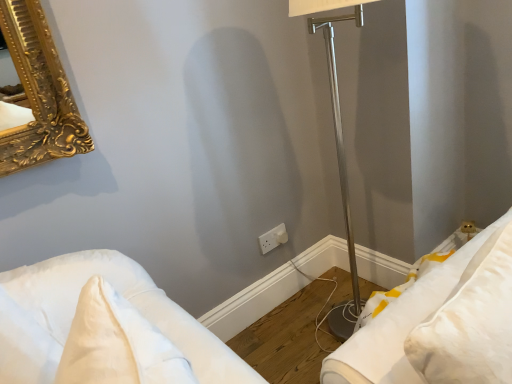
Question: Can white fabric pillow at lower right, the first furniture viewed from the right, be found inside white soft pillow at lower left, the second furniture when ordered from right to left?

Choices:
 (A) yes
 (B) no

Answer: (B)

Question: From the image's perspective, is white soft pillow at lower left, the second furniture when ordered from right to left, below white fabric pillow at lower right, the first furniture viewed from the right?

Choices:
 (A) no
 (B) yes

Answer: (B)

Question: Considering the relative sizes of white soft pillow at lower left, the second furniture when ordered from right to left, and white fabric pillow at lower right, the 2th furniture from the left, in the image provided, is white soft pillow at lower left, the second furniture when ordered from right to left, shorter than white fabric pillow at lower right, the 2th furniture from the left,?

Choices:
 (A) no
 (B) yes

Answer: (B)

Question: Can you confirm if white soft pillow at lower left, marked as the 1th furniture in a left-to-right arrangement, is taller than white fabric pillow at lower right, the first furniture viewed from the right?

Choices:
 (A) yes
 (B) no

Answer: (B)

Question: Is white soft pillow at lower left, marked as the 1th furniture in a left-to-right arrangement, positioned with its back to white fabric pillow at lower right, the first furniture viewed from the right?

Choices:
 (A) no
 (B) yes

Answer: (B)

Question: From their relative heights in the image, would you say white plastic electric outlet at center is taller or shorter than white fabric pillow at lower right, the 2th furniture from the left?

Choices:
 (A) short
 (B) tall

Answer: (A)

Question: In terms of width, does white plastic electric outlet at center look wider or thinner when compared to white fabric pillow at lower right, the first furniture viewed from the right?

Choices:
 (A) thin
 (B) wide

Answer: (A)

Question: Is white plastic electric outlet at center situated inside white fabric pillow at lower right, the 2th furniture from the left, or outside?

Choices:
 (A) outside
 (B) inside

Answer: (A)

Question: From a real-world perspective, is white plastic electric outlet at center physically located above or below white fabric pillow at lower right, the 2th furniture from the left?

Choices:
 (A) above
 (B) below

Answer: (B)

Question: From their relative heights in the image, would you say white plastic electric outlet at center is taller or shorter than white soft pillow at lower left, the second furniture when ordered from right to left?

Choices:
 (A) tall
 (B) short

Answer: (B)

Question: From a real-world perspective, is white plastic electric outlet at center above or below white soft pillow at lower left, the second furniture when ordered from right to left?

Choices:
 (A) above
 (B) below

Answer: (B)

Question: Looking at their shapes, would you say white plastic electric outlet at center is wider or thinner than white soft pillow at lower left, the second furniture when ordered from right to left?

Choices:
 (A) thin
 (B) wide

Answer: (A)

Question: Considering the positions of point (278, 228) and point (26, 274), is point (278, 228) closer or farther from the camera than point (26, 274)?

Choices:
 (A) farther
 (B) closer

Answer: (A)

Question: Based on their sizes in the image, would you say white soft pillow at lower left, marked as the 1th furniture in a left-to-right arrangement, is bigger or smaller than white plastic electric outlet at center?

Choices:
 (A) small
 (B) big

Answer: (B)

Question: In the image, is white soft pillow at lower left, marked as the 1th furniture in a left-to-right arrangement, positioned in front of or behind white plastic electric outlet at center?

Choices:
 (A) behind
 (B) front

Answer: (B)